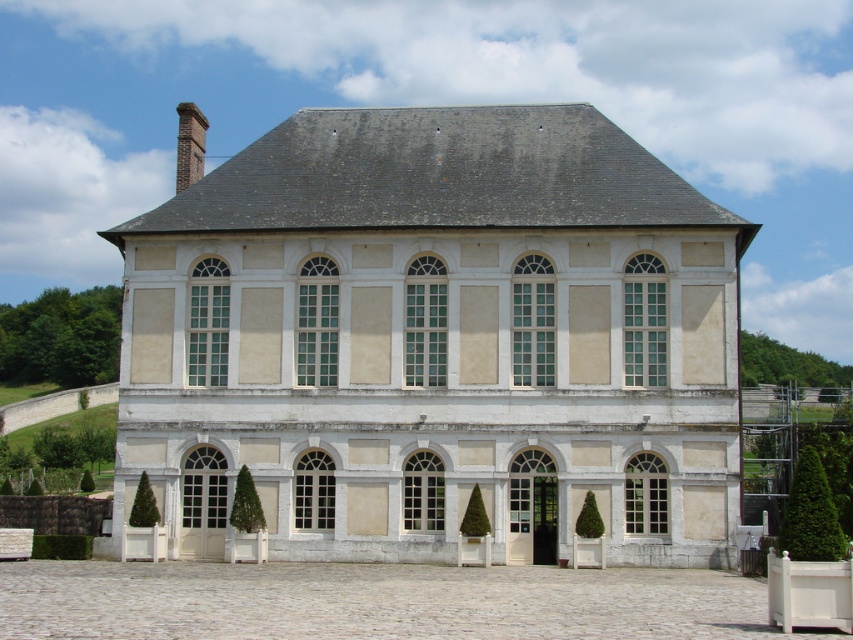
Question: From the image, what is the correct spatial relationship of beige stone palace at center in relation to brick chimney at upper left?

Choices:
 (A) above
 (B) below

Answer: (B)

Question: Which point is farther to the camera?

Choices:
 (A) brick chimney at upper left
 (B) beige stone palace at center

Answer: (A)

Question: Does beige stone palace at center have a larger size compared to brick chimney at upper left?

Choices:
 (A) yes
 (B) no

Answer: (B)

Question: Which point is farther to the camera?

Choices:
 (A) beige stone palace at center
 (B) brick chimney at upper left

Answer: (B)

Question: Observing the image, what is the correct spatial positioning of beige stone palace at center in reference to brick chimney at upper left?

Choices:
 (A) below
 (B) above

Answer: (A)

Question: Among these points, which one is farthest from the camera?

Choices:
 (A) (199, 145)
 (B) (688, 548)

Answer: (A)